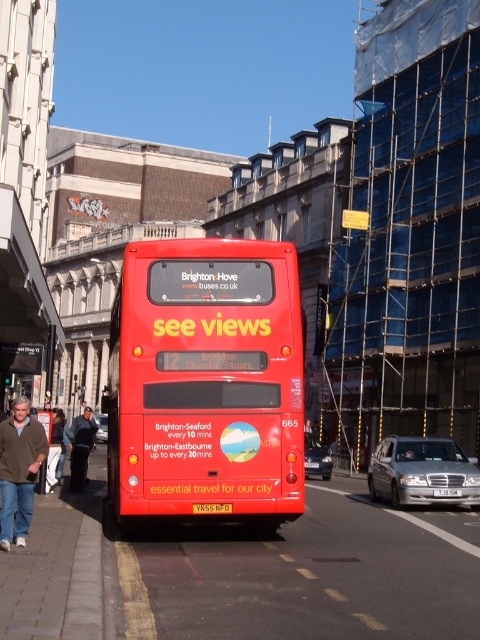
Is silver metallic sedan at lower right to the left of white plastic license plate at center from the viewer's perspective?

In fact, silver metallic sedan at lower right is to the right of white plastic license plate at center.

Who is more forward, (431, 500) or (437, 490)?

Positioned in front is point (437, 490).

Where is `silver metallic sedan at lower right`? This screenshot has width=480, height=640. silver metallic sedan at lower right is located at coordinates (421, 472).

Which of these two, silver metallic sedan at lower right or yellow matte license plate at center, stands taller?

Standing taller between the two is silver metallic sedan at lower right.

Which is below, silver metallic sedan at lower right or yellow matte license plate at center?

silver metallic sedan at lower right is below.

At what (x,y) coordinates should I click in order to perform the action: click on silver metallic sedan at lower right. Please return your answer as a coordinate pair (x, y). This screenshot has width=480, height=640. Looking at the image, I should click on (421, 472).

Is point (312, 467) less distant than point (204, 513)?

That is False.

Which of these two, silver metallic sedan at center or yellow matte license plate at center, stands shorter?

With less height is yellow matte license plate at center.

The height and width of the screenshot is (640, 480). I want to click on silver metallic sedan at center, so click(x=316, y=458).